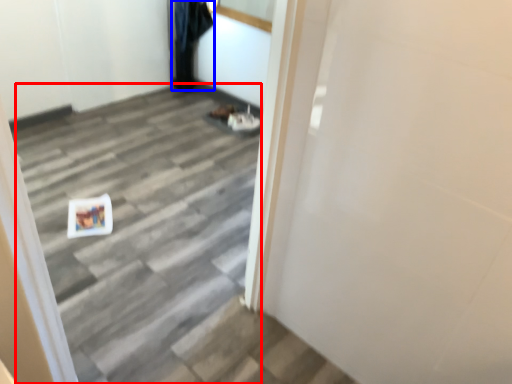
Question: Which object appears closest to the camera in this image, stairwell (highlighted by a red box) or garment (highlighted by a blue box)?

Choices:
 (A) stairwell
 (B) garment

Answer: (A)